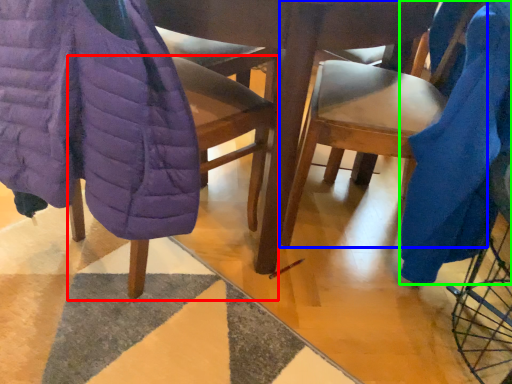
Question: Which object is the closest to the chair (highlighted by a red box)? Choose among these: chair (highlighted by a blue box) or blanket (highlighted by a green box).

Choices:
 (A) chair
 (B) blanket

Answer: (A)